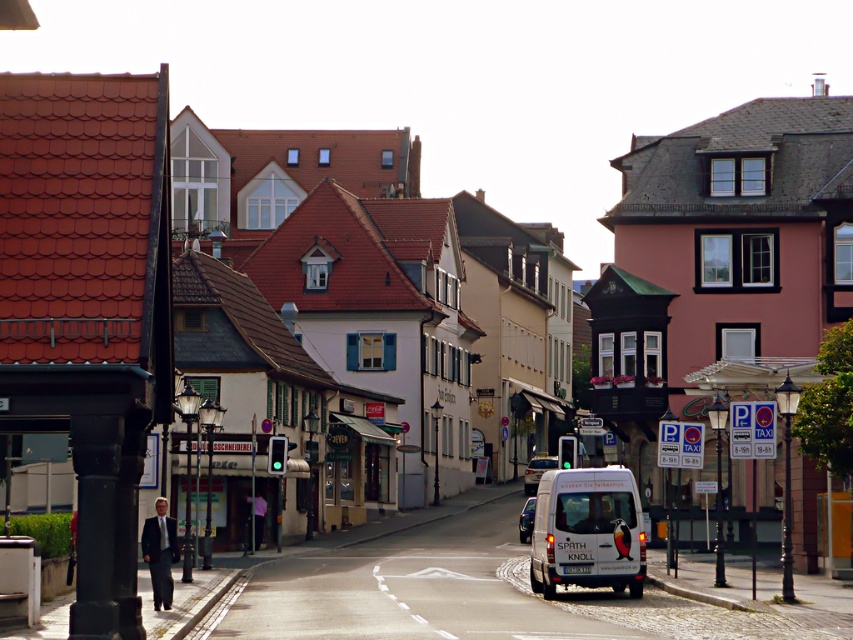
You are a delivery driver who needs to park your 5.5 meter long truck in this street. You see the white matte van at center and the metallic blue van at center. Which van should you avoid parking next to if you want to ensure enough space for your truck?

The metallic blue van at center is longer than the white matte van at center. Since your truck is 5.5 meters long, you should avoid parking next to the metallic blue van at center to ensure sufficient space.

From the picture: You are a pedestrian standing on the cobblestone street and want to cross to the other side. The white matte van at center and metallic blue van at center are parked in your path. Which van should you go around first to reach the other side safely?

You should go around the white matte van at center first because it is closer to you than the metallic blue van at center, so you need to navigate around the nearer one before proceeding further.

You are a pedestrian standing on the cobblestone street and see the white matte van at center and the metallic silver van at center. Which van is positioned higher up the street?

The white matte van at center is positioned higher up the street than the metallic silver van at center because it is located above it.